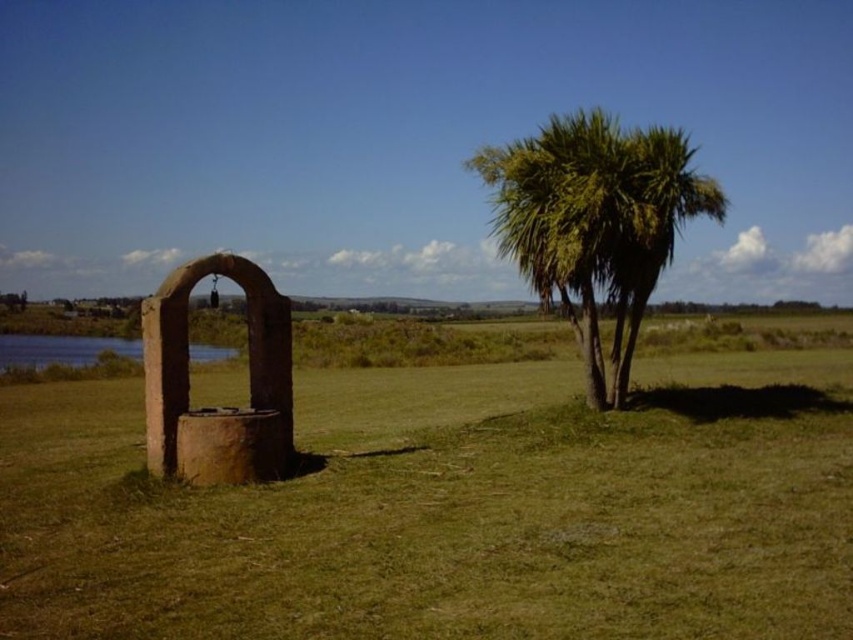
Measure the distance from green grass at lower left to green leafy palm at right.

A distance of 41.64 feet exists between green grass at lower left and green leafy palm at right.

This screenshot has height=640, width=853. Describe the element at coordinates (450, 509) in the screenshot. I see `green grass at lower left` at that location.

Who is more distant from viewer, (283, 608) or (621, 260)?

The point (621, 260) is more distant.

What are the coordinates of `green grass at lower left` in the screenshot? It's located at (450, 509).